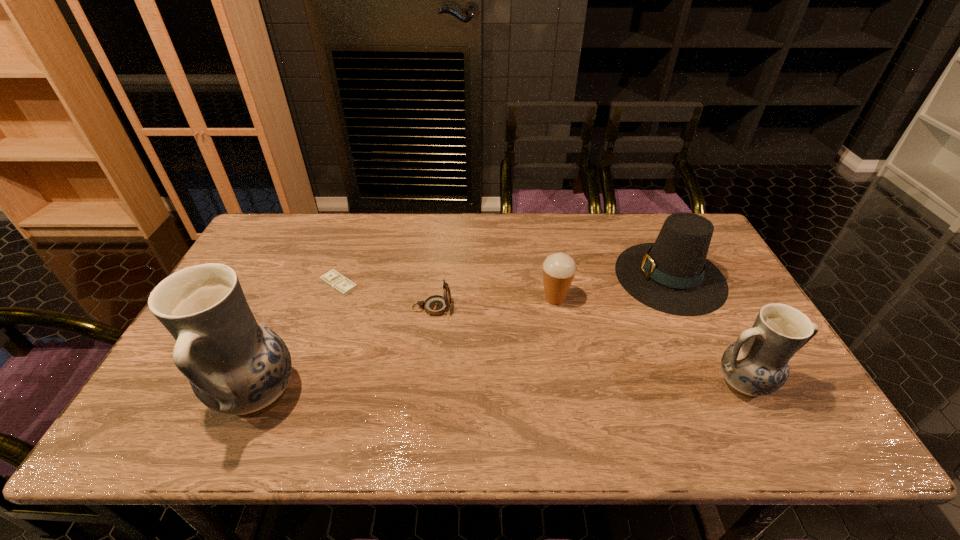
At what (x,y) coordinates should I click in order to perform the action: click on the left pottery. Please return your answer as a coordinate pair (x, y). Looking at the image, I should click on (236, 366).

Locate an element on the screen. Image resolution: width=960 pixels, height=540 pixels. the taller pottery is located at coordinates (236, 366).

The height and width of the screenshot is (540, 960). What are the coordinates of `the right pottery` in the screenshot? It's located at (757, 364).

Where is `icecream`? The image size is (960, 540). icecream is located at coordinates (559, 269).

What are the coordinates of `the fourth tallest object` in the screenshot? It's located at (559, 269).

You are a GUI agent. You are given a task and a screenshot of the screen. Output one action in this format:
    pyautogui.click(x=<x>, y=<y>)
    Task: Click on the third tallest object
    The width and height of the screenshot is (960, 540).
    Given the screenshot: What is the action you would take?
    pyautogui.click(x=672, y=275)

Locate an element on the screen. The image size is (960, 540). the shortest object is located at coordinates [x=335, y=280].

In order to click on the third object from left to right in this screenshot , I will do pyautogui.click(x=435, y=305).

At what (x,y) coordinates should I click in order to perform the action: click on compass. Please return your answer as a coordinate pair (x, y). Looking at the image, I should click on (435, 305).

Locate an element on the screen. This screenshot has height=540, width=960. free space located on the back of the left pottery is located at coordinates (296, 306).